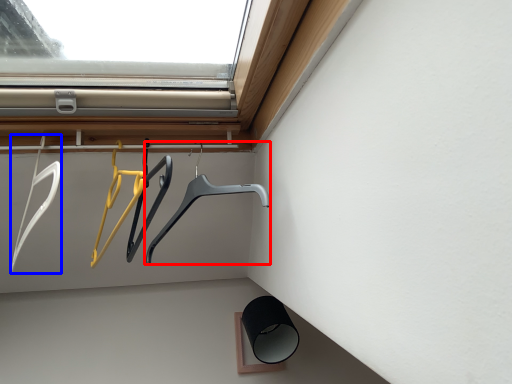
Question: Which object is closer to the camera taking this photo, hanger (highlighted by a red box) or hanger (highlighted by a blue box)?

Choices:
 (A) hanger
 (B) hanger

Answer: (B)